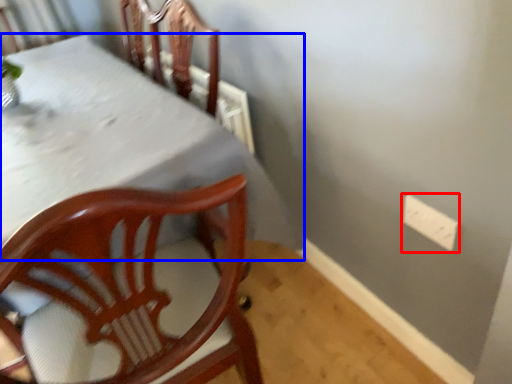
Question: Among these objects, which one is farthest to the camera, electric outlet (highlighted by a red box) or table (highlighted by a blue box)?

Choices:
 (A) electric outlet
 (B) table

Answer: (A)